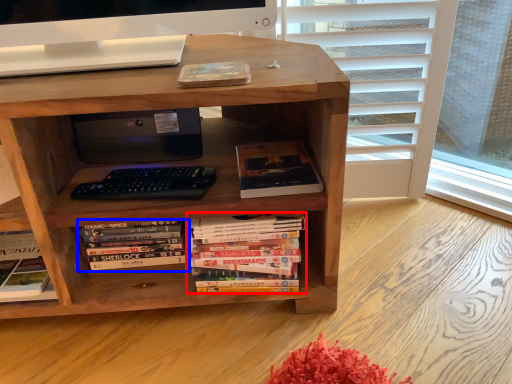
Question: Which object appears farthest to the camera in this image, book (highlighted by a red box) or book (highlighted by a blue box)?

Choices:
 (A) book
 (B) book

Answer: (B)